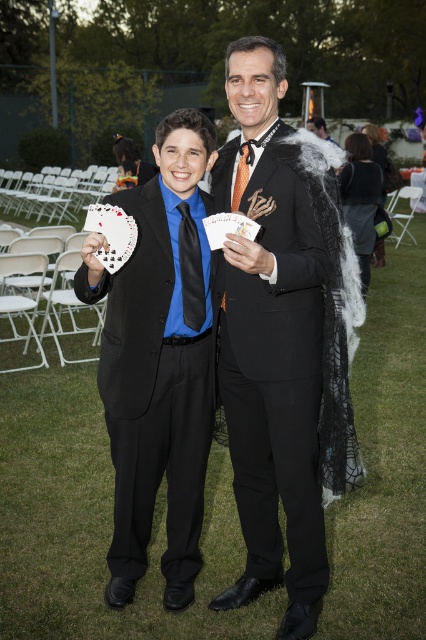
Which is above, white matte hand at center or black fabric coat at center?

black fabric coat at center

Can you confirm if white matte hand at center is shorter than black fabric coat at center?

Correct, white matte hand at center is not as tall as black fabric coat at center.

Locate an element on the screen. Image resolution: width=426 pixels, height=640 pixels. white matte hand at center is located at coordinates (247, 253).

In the scene shown: Between black satin suit at center and black velvet dress at right, which one is positioned lower?

black satin suit at center is lower down.

What do you see at coordinates (279, 346) in the screenshot? This screenshot has width=426, height=640. I see `black satin suit at center` at bounding box center [279, 346].

Is point (330, 257) more distant than point (340, 189)?

No.

Identify the location of black satin suit at center. The image size is (426, 640). point(279,346).

Is black satin suit at center to the right of white matte hand at center from the viewer's perspective?

Yes, black satin suit at center is to the right of white matte hand at center.

From the picture: Who is lower down, black satin suit at center or white matte hand at center?

black satin suit at center is lower down.

Between point (354, 454) and point (264, 248), which one is positioned behind?

The point (354, 454) is behind.

The image size is (426, 640). In order to click on black satin suit at center in this screenshot , I will do `click(279, 346)`.